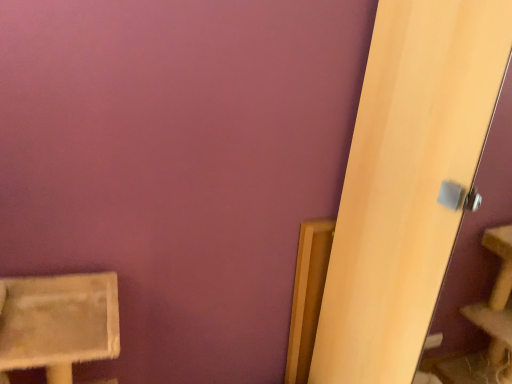
Question: From a real-world perspective, is light wood screen door at right located beneath beige textured cat tree at lower left?

Choices:
 (A) no
 (B) yes

Answer: (A)

Question: Is light wood screen door at right not inside beige textured cat tree at lower left?

Choices:
 (A) yes
 (B) no

Answer: (A)

Question: From the image's perspective, would you say light wood screen door at right is shown under beige textured cat tree at lower left?

Choices:
 (A) yes
 (B) no

Answer: (B)

Question: Is beige textured cat tree at lower left located within light wood screen door at right?

Choices:
 (A) no
 (B) yes

Answer: (A)

Question: Considering the relative positions of light wood screen door at right and beige textured cat tree at lower left in the image provided, is light wood screen door at right to the left of beige textured cat tree at lower left from the viewer's perspective?

Choices:
 (A) no
 (B) yes

Answer: (A)

Question: Can you confirm if light wood screen door at right is wider than beige textured cat tree at lower left?

Choices:
 (A) yes
 (B) no

Answer: (A)

Question: From the image's perspective, would you say beige textured cat tree at lower left is shown under light wood screen door at right?

Choices:
 (A) yes
 (B) no

Answer: (A)

Question: Does beige textured cat tree at lower left have a greater height compared to light wood screen door at right?

Choices:
 (A) yes
 (B) no

Answer: (B)

Question: From a real-world perspective, is beige textured cat tree at lower left below light wood screen door at right?

Choices:
 (A) yes
 (B) no

Answer: (A)

Question: From the image's perspective, is beige textured cat tree at lower left located above light wood screen door at right?

Choices:
 (A) no
 (B) yes

Answer: (A)

Question: Does beige textured cat tree at lower left touch light wood screen door at right?

Choices:
 (A) yes
 (B) no

Answer: (B)

Question: Does beige textured cat tree at lower left have a greater width compared to light wood screen door at right?

Choices:
 (A) no
 (B) yes

Answer: (A)

Question: Considering their positions, is beige textured cat tree at lower left located in front of or behind light wood screen door at right?

Choices:
 (A) behind
 (B) front

Answer: (A)